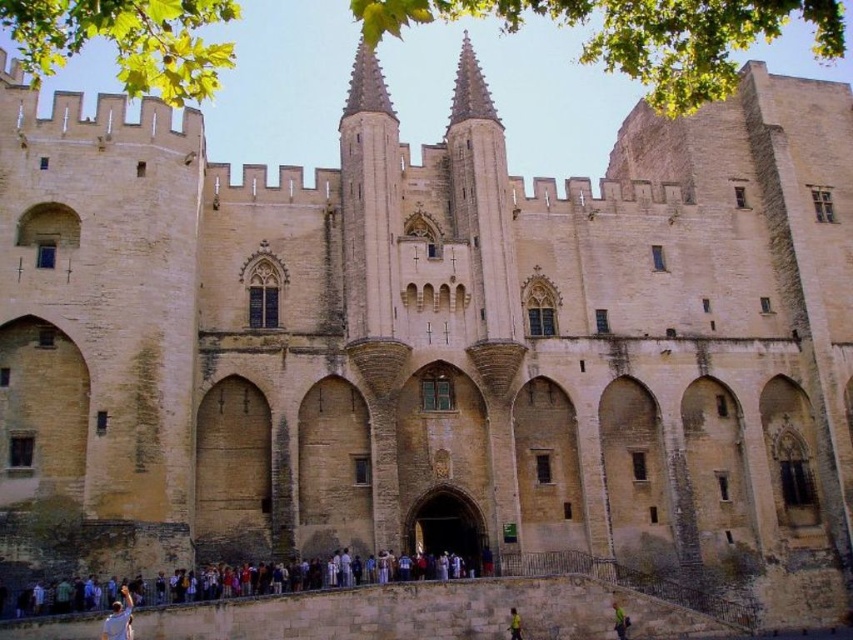
You are standing in front of the medieval building and see the multicolored fabric crowd at lower center and the yellow shirt at lower center. Which object is nearer to you?

The multicolored fabric crowd at lower center is closer to the viewer than the yellow shirt at lower center.

You are a visitor standing in front of the grand medieval building. You notice two items in the foreground. The light blue fabric at lower left and the yellow shirt at lower center. Which item is taller?

The light blue fabric at lower left is much taller than the yellow shirt at lower center.

You are a knight standing in front of the grand medieval building. You see a multicolored fabric crowd at lower center and a yellow shirt at lower center. Which object is positioned to the left when viewed from your perspective?

The multicolored fabric crowd at lower center is to the left of the yellow shirt at lower center, so the multicolored fabric crowd at lower center is positioned to the left.